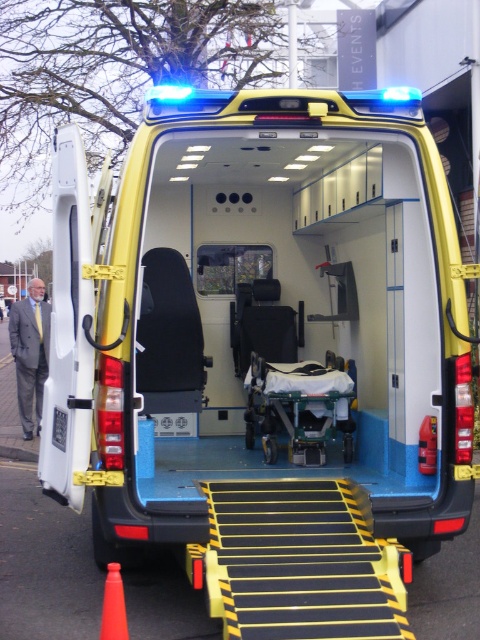
You are a delivery person trying to park your truck in the parking lot where the yellow matte ambulance at center and orange plastic cone at lower left are present. The parking space is narrow. Based on the scene, which object should you avoid hitting to prevent damage due to their size difference?

The yellow matte ambulance at center is larger than the orange plastic cone at lower left, so you should prioritize avoiding hitting the yellow matte ambulance at center to prevent more significant damage.

You are a paramedic who needs to quickly load a stretcher into the yellow matte ambulance at center. There is an orange plastic cone at lower left nearby. To ensure the cone doesn not interfere with the loading process, where should you move the cone?

The orange plastic cone at lower left is currently behind the yellow matte ambulance at center. To prevent interference, move it to a position in front of the ambulance, away from the loading area.